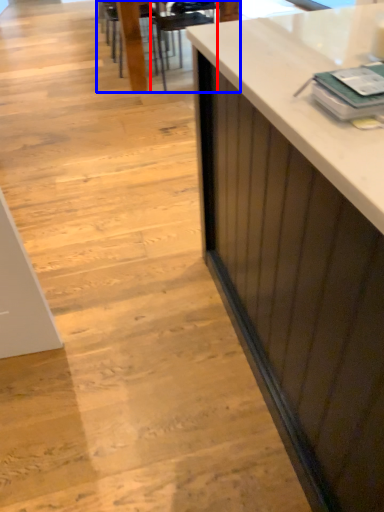
Question: Which point is further to the camera, armchair (highlighted by a red box) or table (highlighted by a blue box)?

Choices:
 (A) armchair
 (B) table

Answer: (B)